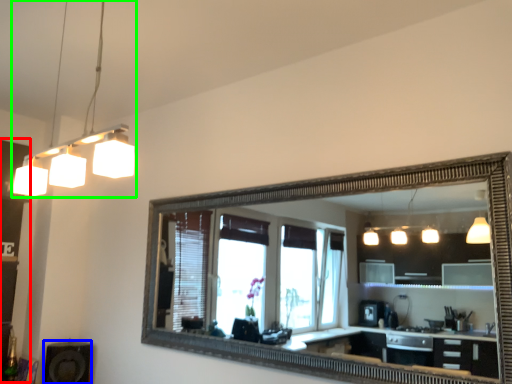
Question: Which is farther away from dresser (highlighted by a red box)? speaker (highlighted by a blue box) or light fixture (highlighted by a green box)?

Choices:
 (A) speaker
 (B) light fixture

Answer: (A)